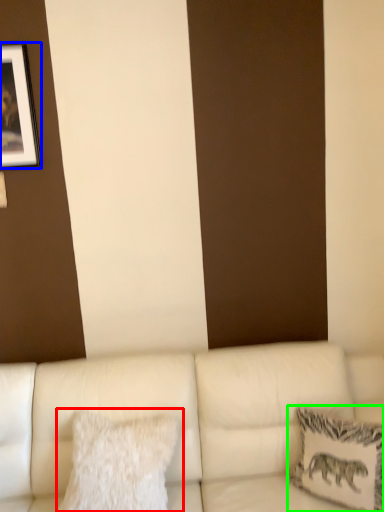
Question: Which is nearer to the pillow (highlighted by a red box)? picture frame (highlighted by a blue box) or pillow (highlighted by a green box).

Choices:
 (A) picture frame
 (B) pillow

Answer: (B)